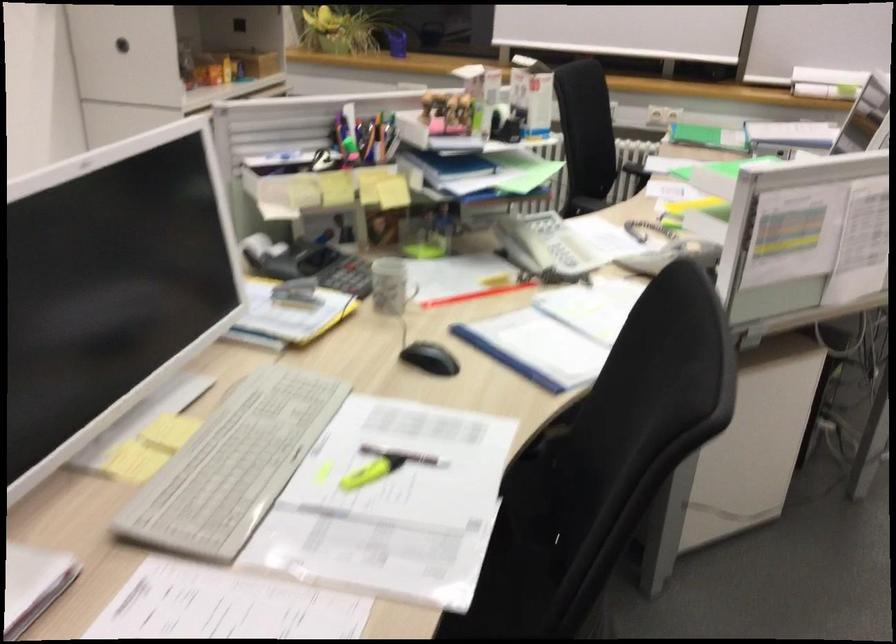
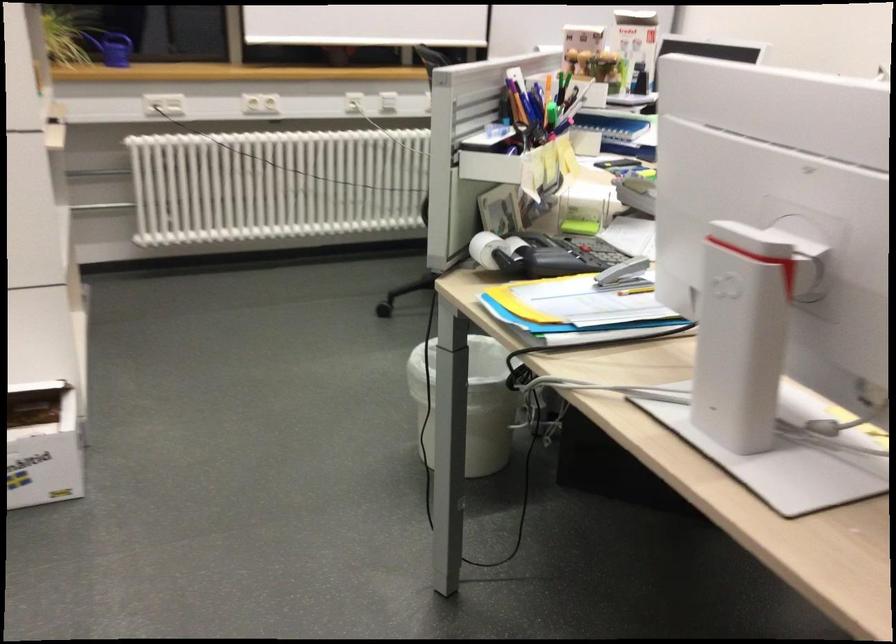
Question: I am providing you with two images of the same scene from different viewpoints. After the viewpoint changes to image2, which objects are now occluded?

Choices:
 (A) white telephone handset
 (B) silver ladle
 (C) yellow pencil
 (D) grey stapler

Answer: (A)